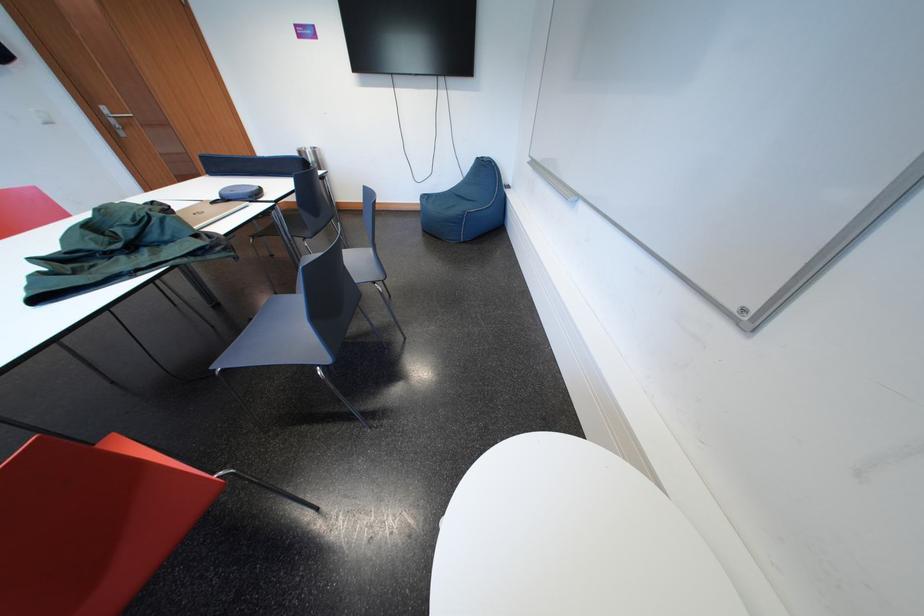
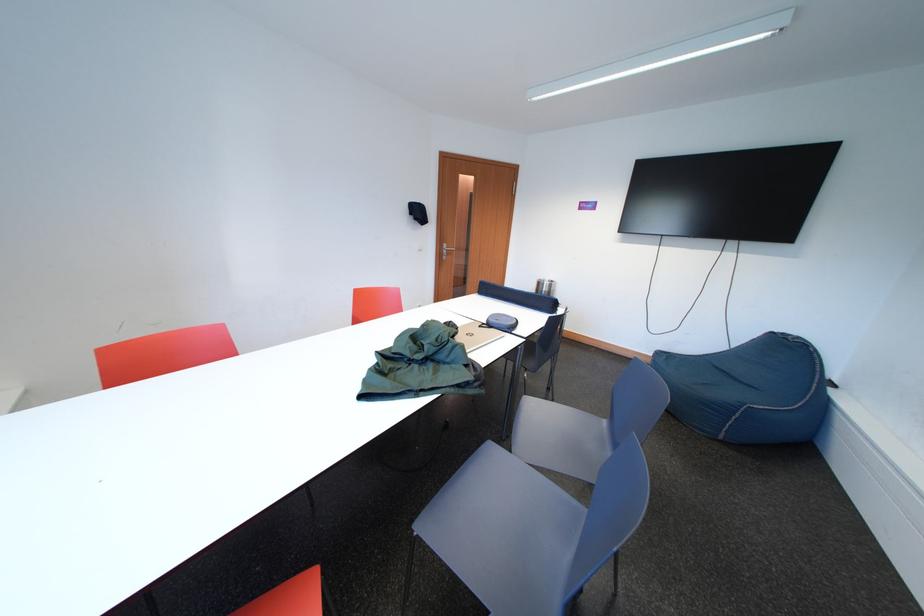
Locate, in the second image, the point that corresponds to (x=113, y=113) in the first image.

(455, 249)